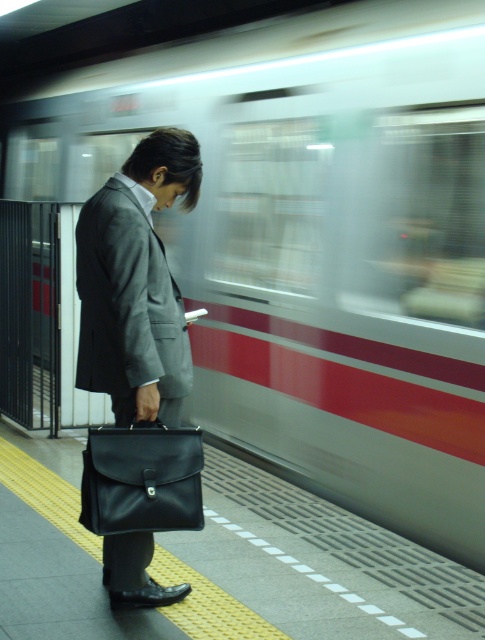
Which is in front, point (80, 355) or point (174, 483)?

Point (174, 483) is in front.

Identify the location of gray matte suit at center. (130, 301).

This screenshot has width=485, height=640. What are the coordinates of `gray matte suit at center` in the screenshot? It's located at (130, 301).